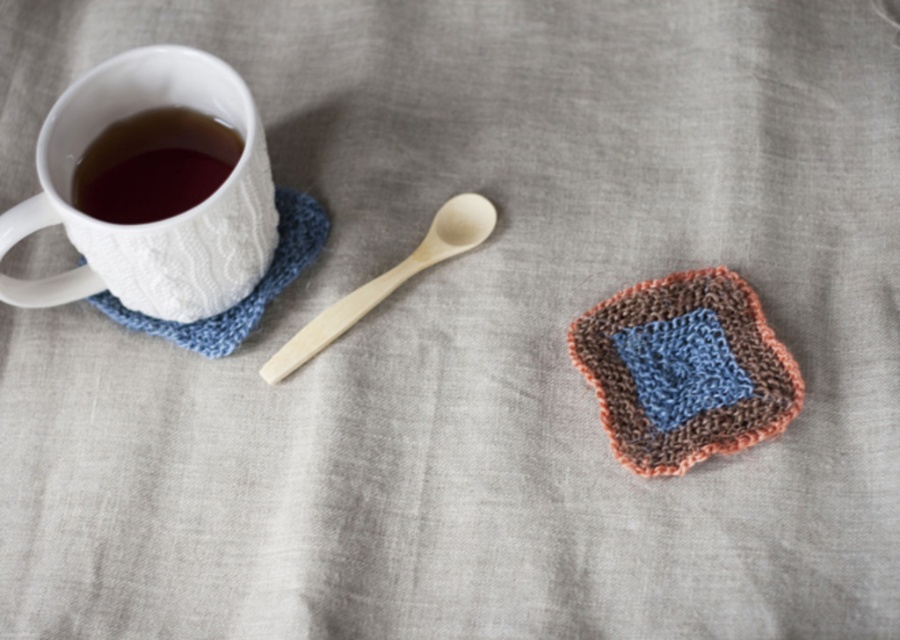
Question: Based on their relative distances, which object is farther from the brown matte cup at upper left?

Choices:
 (A) wooden spoon at center
 (B) white textured mug at upper left

Answer: (A)

Question: Can you confirm if white textured mug at upper left is wider than brown matte cup at upper left?

Choices:
 (A) yes
 (B) no

Answer: (A)

Question: Which object appears closest to the camera in this image?

Choices:
 (A) wooden spoon at center
 (B) brown matte cup at upper left

Answer: (B)

Question: Does brown matte cup at upper left have a lesser width compared to wooden spoon at center?

Choices:
 (A) no
 (B) yes

Answer: (B)

Question: Which of the following is the farthest from the observer?

Choices:
 (A) (326, 326)
 (B) (171, 209)
 (C) (21, 211)

Answer: (A)

Question: Does white textured mug at upper left appear under wooden spoon at center?

Choices:
 (A) no
 (B) yes

Answer: (A)